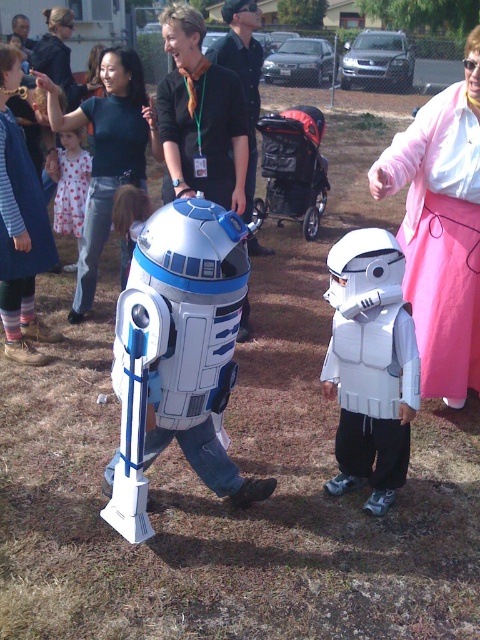
Who is taller, brushed metal vest at left or polka dot dress at center?

brushed metal vest at left is taller.

Is point (47, 221) more distant than point (69, 184)?

No, (47, 221) is in front of (69, 184).

Image resolution: width=480 pixels, height=640 pixels. Identify the location of brushed metal vest at left. (23, 209).

Does dark blue sweater at upper center have a smaller size compared to polka dot dress at center?

Incorrect, dark blue sweater at upper center is not smaller in size than polka dot dress at center.

Is point (105, 83) positioned in front of point (68, 218)?

Yes, it is in front of point (68, 218).

Where is `dark blue sweater at upper center`? This screenshot has width=480, height=640. dark blue sweater at upper center is located at coordinates (108, 154).

Which is in front, point (50, 230) or point (129, 230)?

Point (129, 230) is in front.

Which is behind, point (8, 141) or point (144, 220)?

The point (144, 220) is more distant.

Between point (17, 260) and point (152, 208), which one is positioned in front?

Point (17, 260) is more forward.

The image size is (480, 640). What are the coordinates of `brushed metal vest at left` in the screenshot? It's located at [23, 209].